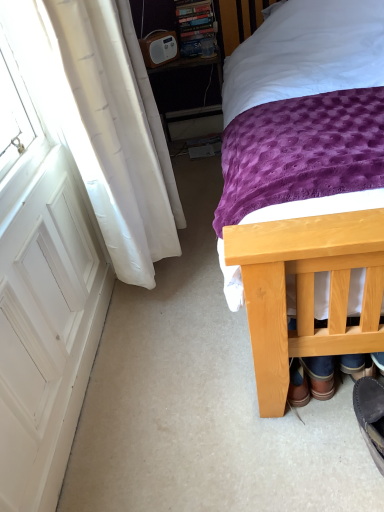
Question: Is white matte screen door at left shorter than wooden bed at center?

Choices:
 (A) no
 (B) yes

Answer: (B)

Question: Is white matte screen door at left completely or partially outside of wooden bed at center?

Choices:
 (A) yes
 (B) no

Answer: (A)

Question: Could you tell me if white matte screen door at left is turned towards wooden bed at center?

Choices:
 (A) no
 (B) yes

Answer: (B)

Question: Considering the relative sizes of white matte screen door at left and wooden bed at center in the image provided, is white matte screen door at left thinner than wooden bed at center?

Choices:
 (A) no
 (B) yes

Answer: (B)

Question: From a real-world perspective, is white matte screen door at left physically below wooden bed at center?

Choices:
 (A) no
 (B) yes

Answer: (B)

Question: From a real-world perspective, is white matte screen door at left above or below dark grey suede shoe at lower right, placed as the 1th footwear when sorted from right to left?

Choices:
 (A) below
 (B) above

Answer: (B)

Question: Is white matte screen door at left in front of or behind dark grey suede shoe at lower right, the 2th footwear positioned from the left, in the image?

Choices:
 (A) behind
 (B) front

Answer: (A)

Question: Based on their positions, is white matte screen door at left located to the left or right of dark grey suede shoe at lower right, the 2th footwear viewed from the back?

Choices:
 (A) right
 (B) left

Answer: (B)

Question: Considering the positions of point (87, 262) and point (380, 458), is point (87, 262) closer or farther from the camera than point (380, 458)?

Choices:
 (A) closer
 (B) farther

Answer: (B)

Question: Relative to wooden bed at center, is white matte screen door at left in front or behind?

Choices:
 (A) behind
 (B) front

Answer: (A)

Question: From a real-world perspective, is white matte screen door at left positioned above or below wooden bed at center?

Choices:
 (A) below
 (B) above

Answer: (A)

Question: Looking at the image, does white matte screen door at left seem bigger or smaller compared to wooden bed at center?

Choices:
 (A) big
 (B) small

Answer: (B)

Question: Considering the positions of white matte screen door at left and wooden bed at center in the image, is white matte screen door at left taller or shorter than wooden bed at center?

Choices:
 (A) tall
 (B) short

Answer: (B)

Question: In terms of height, does white plastic radio at upper center look taller or shorter compared to white matte screen door at left?

Choices:
 (A) tall
 (B) short

Answer: (A)

Question: In the image, is white plastic radio at upper center positioned in front of or behind white matte screen door at left?

Choices:
 (A) front
 (B) behind

Answer: (B)